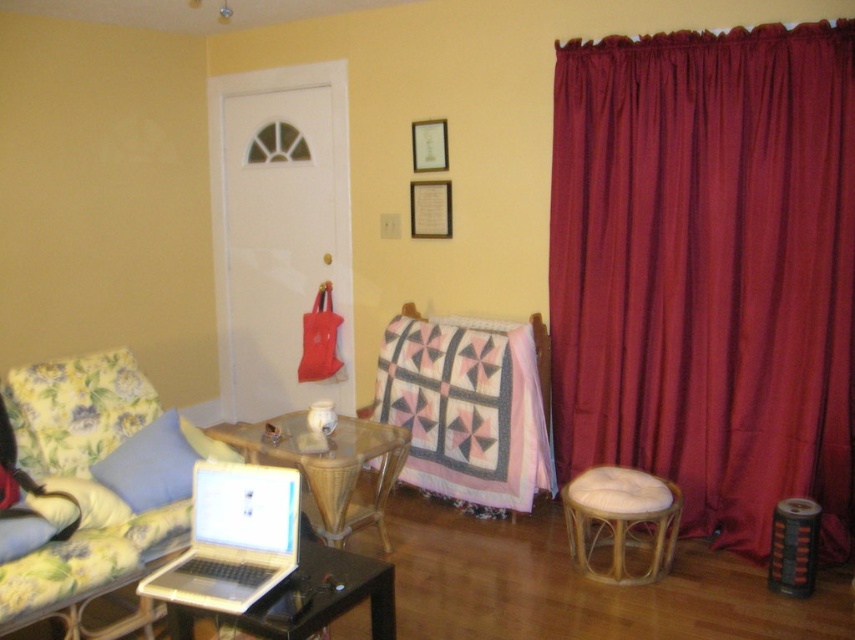
Question: Estimate the real-world distances between objects in this image. Which object is farther from the fluffy yellow pillow at lower left?

Choices:
 (A) floral fabric couch at lower left
 (B) rattan/wooden stool at lower right

Answer: (B)

Question: Which point is farther to the camera?

Choices:
 (A) (43, 541)
 (B) (189, 432)
 (C) (535, 392)
 (D) (209, 506)

Answer: (C)

Question: Considering the relative positions of transparent glass table at center and fluffy yellow pillow at lower left in the image provided, where is transparent glass table at center located with respect to fluffy yellow pillow at lower left?

Choices:
 (A) right
 (B) left

Answer: (A)

Question: Is floral fabric couch at lower left thinner than rattan/wooden stool at lower right?

Choices:
 (A) no
 (B) yes

Answer: (A)

Question: Estimate the real-world distances between objects in this image. Which object is farther from the blue fabric pillow at left?

Choices:
 (A) silver metallic laptop at lower left
 (B) fluffy yellow pillow at lower left
 (C) floral fabric couch at lower left
 (D) transparent glass table at center

Answer: (A)

Question: Does transparent glass table at center have a smaller size compared to white glossy table at center?

Choices:
 (A) no
 (B) yes

Answer: (A)